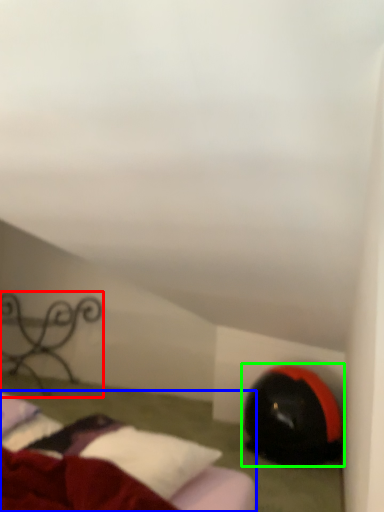
Question: Considering the real-world distances, which object is closest to furniture (highlighted by a red box)? bed (highlighted by a blue box) or bean bag chair (highlighted by a green box).

Choices:
 (A) bed
 (B) bean bag chair

Answer: (B)